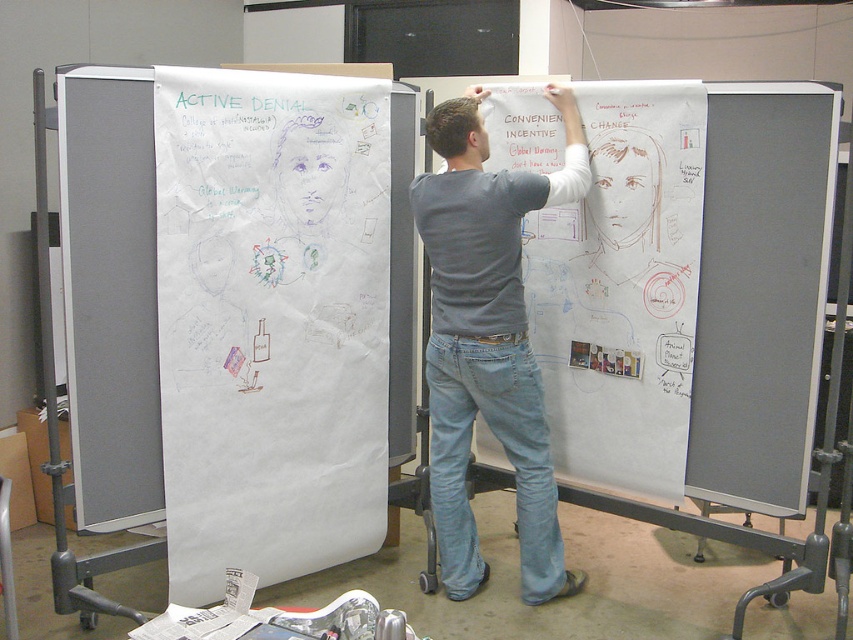
Measure the distance between white paper at left and camera.

white paper at left is 2.34 meters away from camera.

Can you confirm if white paper at left is smaller than gray cotton shirt at center?

No, white paper at left is not smaller than gray cotton shirt at center.

Where is `white paper at left`? white paper at left is located at coordinates (258, 314).

I want to click on white paper at left, so click(258, 314).

Based on the photo, which of these two, white paperboard at center or gray cotton shirt at center, stands taller?

Standing taller between the two is gray cotton shirt at center.

Between white paperboard at center and gray cotton shirt at center, which one appears on the left side from the viewer's perspective?

Positioned to the left is gray cotton shirt at center.

This screenshot has width=853, height=640. Describe the element at coordinates (622, 289) in the screenshot. I see `white paperboard at center` at that location.

Find the location of a particular element. This screenshot has height=640, width=853. white paperboard at center is located at coordinates (622, 289).

Which is more to the right, white paper at left or white paperboard at center?

white paperboard at center

Consider the image. Is white paper at left bigger than white paperboard at center?

Yes, white paper at left is bigger than white paperboard at center.

Is point (126, 241) farther from camera compared to point (544, 296)?

No.

Where is `white paper at left`? The image size is (853, 640). white paper at left is located at coordinates (258, 314).